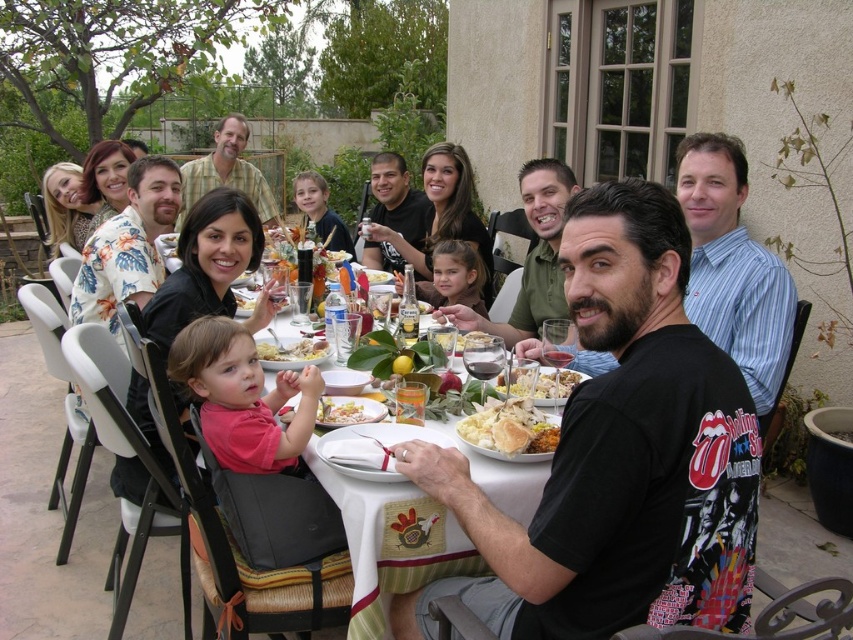
Question: Estimate the real-world distances between objects in this image. Which object is closer to the pink cotton shirt at center?

Choices:
 (A) green plaid shirt at upper center
 (B) matte black t-shirt at center
 (C) yellow matte plate at center
 (D) yellowish matte plate at center

Answer: (B)

Question: Considering the real-world distances, which object is farthest from the matte black t-shirt at center?

Choices:
 (A) black t-shirt at center
 (B) pink cotton shirt at center

Answer: (B)

Question: Is matte black t-shirt at center to the left of pink cotton shirt at center from the viewer's perspective?

Choices:
 (A) yes
 (B) no

Answer: (B)

Question: Which object is the farthest from the black t-shirt at center?

Choices:
 (A) white glossy plate at center
 (B) white cloth table at center
 (C) yellowish matte pasta at center
 (D) yellow matte plate at center

Answer: (D)

Question: Is black t-shirt at center to the right of yellowish matte plate at center from the viewer's perspective?

Choices:
 (A) no
 (B) yes

Answer: (B)

Question: Considering the relative positions of yellowish matte plate at center and yellow matte plate at center in the image provided, where is yellowish matte plate at center located with respect to yellow matte plate at center?

Choices:
 (A) right
 (B) left

Answer: (B)